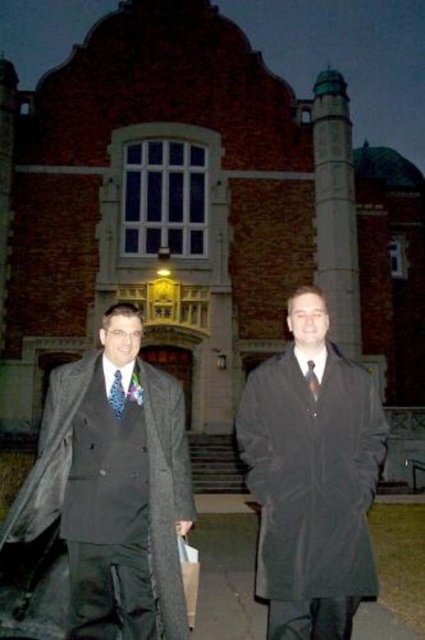
You are a photographer preparing to take a portrait of the person wearing the matte black coat at center and the matte black tie at center. Since you want to ensure both items are visible in the frame, which item should you position closer to the center of the camera viewfinder to avoid cropping?

The matte black coat at center is to the left of the matte black tie at center, so positioning the matte black tie at center closer to the center of the camera viewfinder would help keep both items within the frame as the coat is already shifted left.

You are a photographer at a formal event and need to capture a clear photo of both the matte blue tie at left and the matte black tie at center. However, due to the lighting, you can only focus on one subject at a time. Which tie should you focus on to ensure the other is still partially visible in the background?

You should focus on the matte blue tie at left because it is in front of the matte black tie at center, so if you focus on the matte blue tie at left, the matte black tie at center will be in the background and still partially visible.